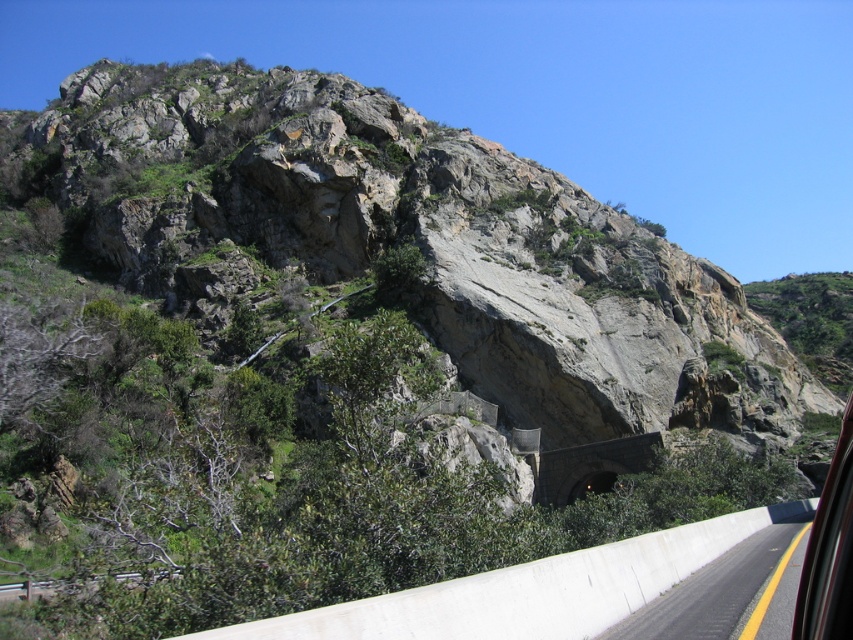
Between white concrete barrier at lower right and transparent glass car window at right, which one appears on the right side from the viewer's perspective?

transparent glass car window at right

Can you confirm if white concrete barrier at lower right is shorter than transparent glass car window at right?

Yes, white concrete barrier at lower right is shorter than transparent glass car window at right.

This screenshot has height=640, width=853. What do you see at coordinates (711, 592) in the screenshot? I see `white concrete barrier at lower right` at bounding box center [711, 592].

In order to click on white concrete barrier at lower right in this screenshot , I will do `click(711, 592)`.